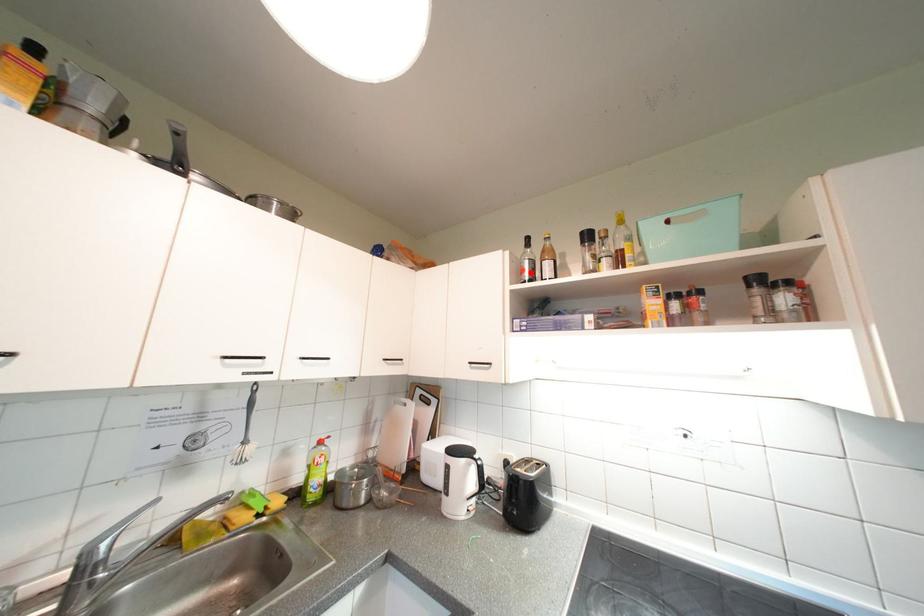
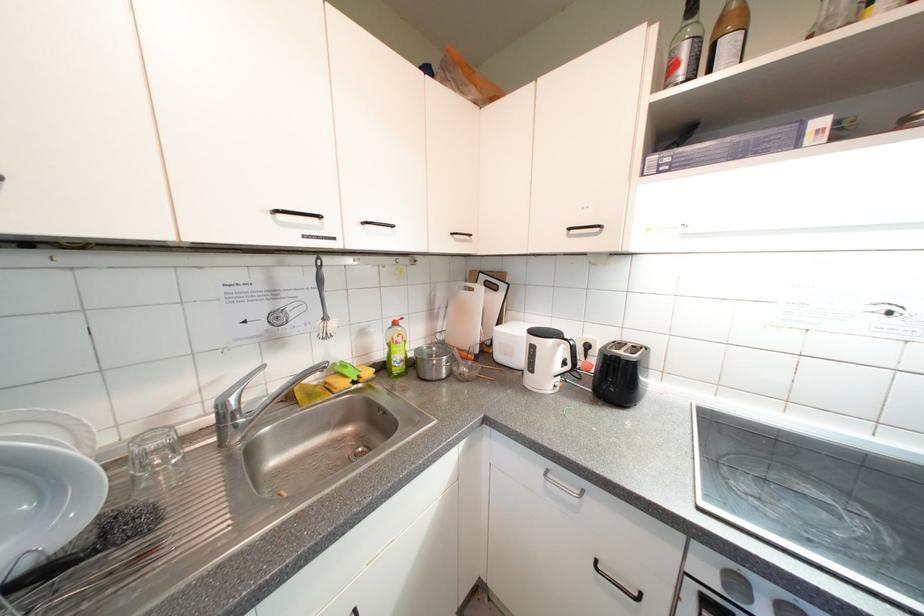
Locate, in the second image, the point that corresponds to the highlighted location in the first image.

(683, 68)